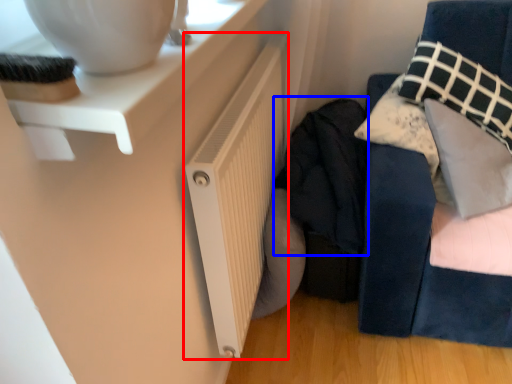
Question: Which point is closer to the camera, radiator (highlighted by a red box) or clothing (highlighted by a blue box)?

Choices:
 (A) radiator
 (B) clothing

Answer: (A)